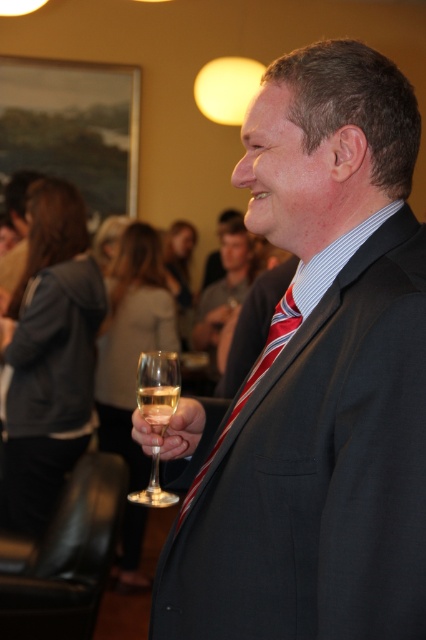
Question: Is matte black suit at center bigger than striped fabric tie at center?

Choices:
 (A) no
 (B) yes

Answer: (B)

Question: Which object appears farthest from the camera in this image?

Choices:
 (A) striped fabric tie at center
 (B) clear glass wine glass at center
 (C) clear glass at center

Answer: (C)

Question: Is matte black suit at center bigger than striped fabric tie at center?

Choices:
 (A) no
 (B) yes

Answer: (B)

Question: Which of the following is the closest to the observer?

Choices:
 (A) striped fabric tie at center
 (B) clear glass at center

Answer: (A)

Question: Is matte black suit at center wider than striped fabric tie at center?

Choices:
 (A) yes
 (B) no

Answer: (A)

Question: Which point is closer to the camera?

Choices:
 (A) (164, 412)
 (B) (374, 387)
 (C) (195, 476)
 (D) (154, 365)

Answer: (B)